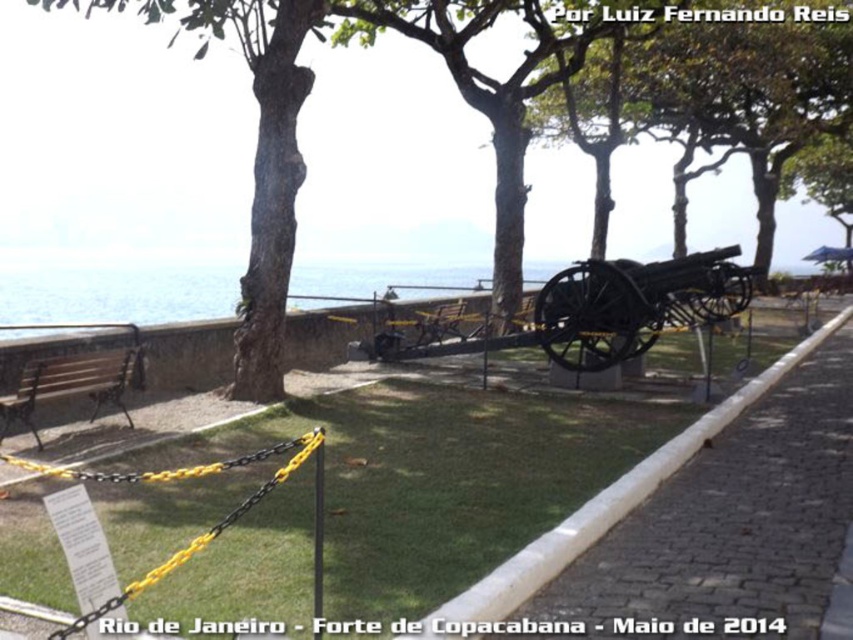
Question: Which is nearer to the blue water at center?

Choices:
 (A) brown wood tree at center
 (B) black metal cannon at center
 (C) polished metal bench at lower left

Answer: (A)

Question: Which object appears closest to the camera in this image?

Choices:
 (A) polished metal bench at lower left
 (B) blue water at center
 (C) brown wood tree at center
 (D) black metal cannon at center

Answer: (A)

Question: Is brown wood tree at center positioned at the back of black metal cannon at center?

Choices:
 (A) yes
 (B) no

Answer: (B)

Question: Is blue water at center closer to the viewer compared to black metal cannon at center?

Choices:
 (A) yes
 (B) no

Answer: (A)

Question: Which point is farther from the camera taking this photo?

Choices:
 (A) (27, 417)
 (B) (99, 312)
 (C) (538, 324)
 (D) (309, 157)

Answer: (D)

Question: Does blue water at center have a greater width compared to black metal cannon at center?

Choices:
 (A) no
 (B) yes

Answer: (B)